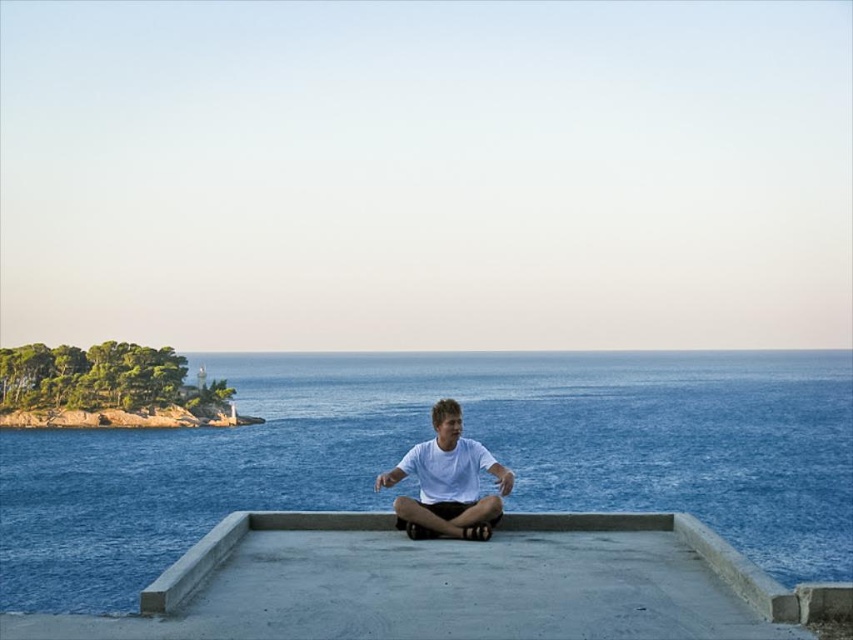
Who is more distant from viewer, [779,412] or [790,600]?

Point [779,412]

Between blue water at center and concrete at center, which one appears on the left side from the viewer's perspective?

Positioned to the left is concrete at center.

What do you see at coordinates (427, 436) in the screenshot?
I see `blue water at center` at bounding box center [427, 436].

Where is `blue water at center`? This screenshot has height=640, width=853. blue water at center is located at coordinates (427, 436).

What do you see at coordinates (427, 436) in the screenshot? I see `blue water at center` at bounding box center [427, 436].

Is blue water at center below white matte shirt at center?

Indeed, blue water at center is positioned under white matte shirt at center.

Who is more forward, [396,396] or [451,417]?

Point [451,417]

Where is `blue water at center`? The image size is (853, 640). blue water at center is located at coordinates (427, 436).

Does concrete at center appear on the right side of white matte shirt at center?

No, concrete at center is not to the right of white matte shirt at center.

The image size is (853, 640). Identify the location of concrete at center. (688, 545).